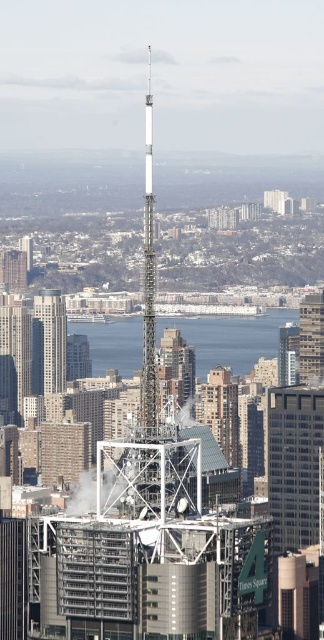
You are a drone operator trying to navigate between two points in the city. You need to fly from the point at coordinates point (116, 330) to the point at coordinates point (44, 332). Given the city layout described, which direction should you fly to reach your destination?

To fly from point (116, 330) to point (44, 332), you should fly downward since point (116, 330) is in front of point (44, 332), indicating it is higher up in the aerial view.

You are a city planner who needs to install a new communication antenna that requires a minimum of 300 feet of clearance between the two structures to avoid signal interference. Given the distance between the matte silver skyscraper at center and the metallic silver tower at right, will this requirement be met?

The matte silver skyscraper at center is 313.30 feet from the metallic silver tower at right, which exceeds the minimum 300 feet clearance requirement. Therefore, the signal interference requirement will be met.

You are a drone operator trying to capture a photo of the metallic silver tower at right. You notice the matte silver skyscraper at center is blocking your view. Can you adjust your position to avoid the obstruction?

The matte silver skyscraper at center is in front of the metallic silver tower at right, so you can move your drone to the side or behind the skyscraper to get an unobstructed view of the metallic silver tower at right.